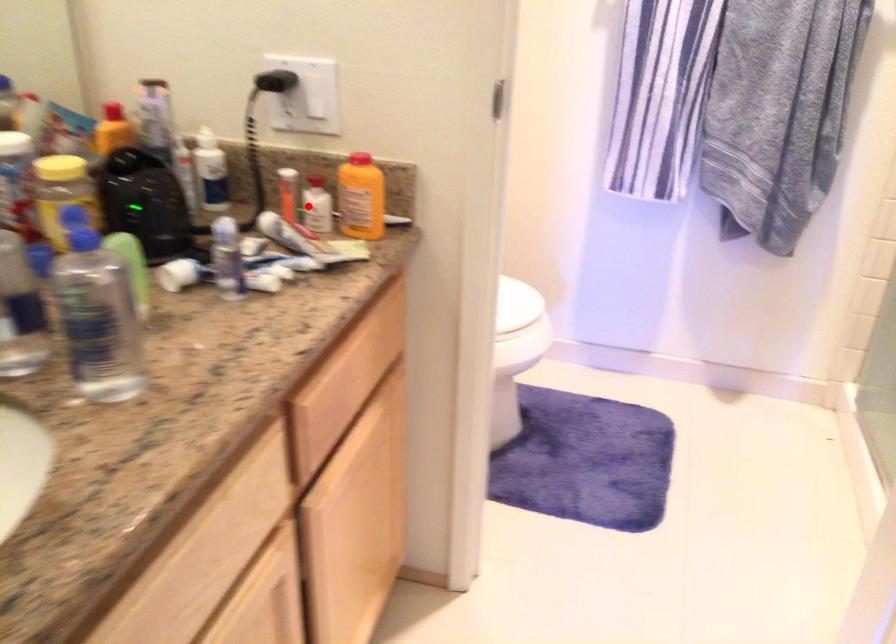
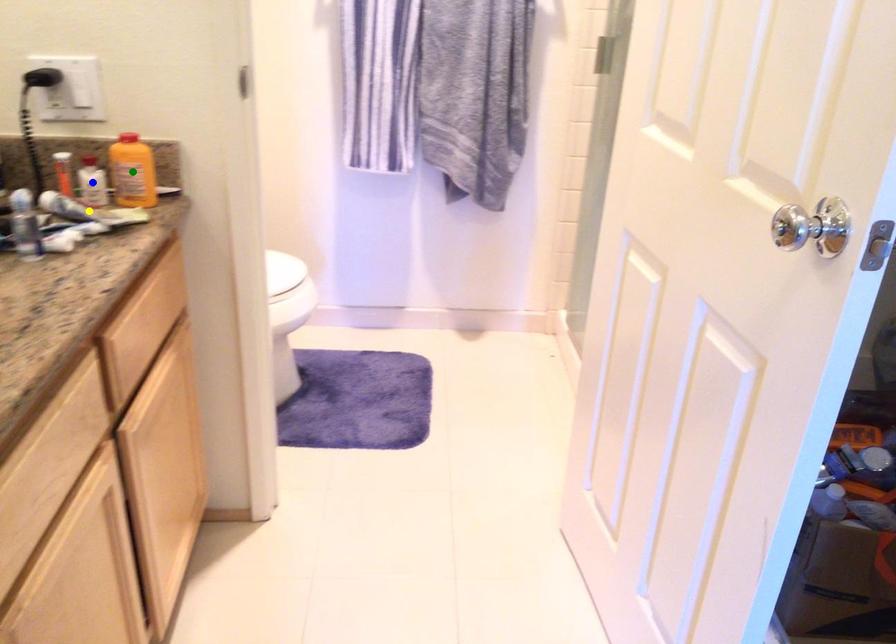
Question: I am providing you with two images of the same scene from different viewpoints. A red point is marked on the first image. You are given multiple points on the second image. Which point in image 2 represents the same 3d spot as the red point in image 1?

Choices:
 (A) yellow point
 (B) green point
 (C) blue point

Answer: (C)